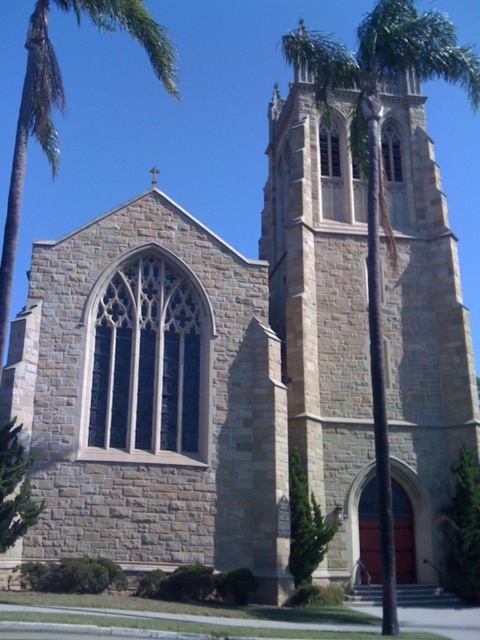
You are standing in front of the Gothic church and want to walk towards the green leafy tree at center and the green textured bush at lower center. Which one will you encounter first?

You will encounter the green leafy tree at center first because it is closer to you than the green textured bush at lower center.

You are a landscape architect designing a garden around the Gothic church. You need to place the green leafy tree at center and the green textured bush at lower center. Considering their widths, which plant should be placed closer to the church entrance to ensure they don not block the pathway?

The green textured bush at lower center should be placed closer to the church entrance since it is narrower than the green leafy tree at center, which is wider. This arrangement will prevent the wider tree from obstructing the pathway.